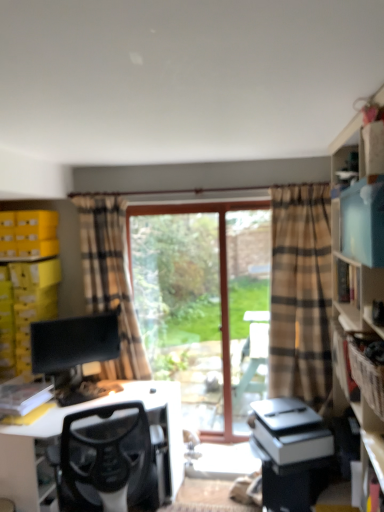
Measure the distance between white plastic printer at center and camera.

white plastic printer at center and camera are 2.36 meters apart.

Measure the distance between point (x=145, y=447) and camera.

A distance of 2.30 meters exists between point (x=145, y=447) and camera.

Locate an element on the screen. This screenshot has height=512, width=384. wooden screen door at center is located at coordinates (248, 306).

Find the location of a particular element. matte blue shelf at right, which appears as the 1th shelf when viewed from the right is located at coordinates (337, 291).

Is black mesh chair at lower left next to brown cardboard crate at right and touching it?

No, black mesh chair at lower left is not in contact with brown cardboard crate at right.

In the image, there is a brown cardboard crate at right. In order to click on chair below it (from a real-world perspective) in this screenshot , I will do `click(107, 459)`.

Who is smaller, black mesh chair at lower left or brown cardboard crate at right?

Smaller between the two is brown cardboard crate at right.

From the image's perspective, is black mesh chair at lower left on brown cardboard crate at right?

No, from the image's perspective, black mesh chair at lower left is not on top of brown cardboard crate at right.

From a real-world perspective, is wooden screen door at center located beneath clear glass window at center?

Yes.

From the image's perspective, is wooden screen door at center located above or below clear glass window at center?

wooden screen door at center is above clear glass window at center.

Does wooden screen door at center turn towards clear glass window at center?

No, wooden screen door at center is not facing towards clear glass window at center.

This screenshot has height=512, width=384. I want to click on window behind the wooden screen door at center, so click(204, 303).

Are yellow cardboard boxes at left, which ranks as the 1th shelf in left-to-right order, and black mesh chair at lower left making contact?

No, yellow cardboard boxes at left, which ranks as the 1th shelf in left-to-right order, is not beside black mesh chair at lower left.

Is black mesh chair at lower left located within yellow cardboard boxes at left, the 1th shelf viewed from the back?

Actually, black mesh chair at lower left is outside yellow cardboard boxes at left, the 1th shelf viewed from the back.

From the image's perspective, between yellow cardboard boxes at left, the 1th shelf viewed from the back, and black mesh chair at lower left, who is located below?

black mesh chair at lower left is shown below in the image.

This screenshot has height=512, width=384. Find the location of `curtain lying on the left of white plastic printer at center`. curtain lying on the left of white plastic printer at center is located at coordinates coord(110,279).

Does point (112, 223) come farther from viewer compared to point (308, 412)?

That is True.

In the scene shown: Is beige plaid curtain at left positioned with its back to white plastic printer at center?

No, beige plaid curtain at left is not facing the opposite direction of white plastic printer at center.

Could white plastic printer at center be considered to be inside beige plaid curtain at left?

No, white plastic printer at center is located outside of beige plaid curtain at left.

Is black mesh chair at lower left in front of or behind white plastic printer at center in the image?

Clearly, black mesh chair at lower left is behind white plastic printer at center.

Is black mesh chair at lower left wider or thinner than white plastic printer at center?

In the image, black mesh chair at lower left appears to be wider than white plastic printer at center.

Which of these two, black mesh chair at lower left or white plastic printer at center, is bigger?

black mesh chair at lower left is bigger.

Is matte black monitor at left positioned with its back to beige plaid curtain at left?

No, matte black monitor at left is not facing the opposite direction of beige plaid curtain at left.

Which object is more forward, matte black monitor at left or beige plaid curtain at left?

matte black monitor at left.

Consider the image. From the image's perspective, is matte black monitor at left under beige plaid curtain at left?

Yes, from the image's perspective, matte black monitor at left is below beige plaid curtain at left.

Who is smaller, matte black monitor at left or beige plaid curtain at left?

Smaller between the two is matte black monitor at left.

Is black mesh chair at lower left far from clear glass window at center?

No, black mesh chair at lower left is in close proximity to clear glass window at center.

Does black mesh chair at lower left have a lesser height compared to clear glass window at center?

Indeed, black mesh chair at lower left has a lesser height compared to clear glass window at center.

Is black mesh chair at lower left not inside clear glass window at center?

black mesh chair at lower left lies outside clear glass window at center's area.

Looking at this image, from the image's perspective, which one is positioned higher, black mesh chair at lower left or clear glass window at center?

clear glass window at center, from the image's perspective.

Find the location of a particular element. crate that is above the black mesh chair at lower left (from a real-world perspective) is located at coordinates (367, 378).

The width and height of the screenshot is (384, 512). Find the location of `screen door in front of the clear glass window at center`. screen door in front of the clear glass window at center is located at coordinates (248, 306).

Based on their spatial positions, is brown cardboard crate at right or beige plaid curtain at left further from wooden screen door at center?

The object further to wooden screen door at center is brown cardboard crate at right.

When comparing their distances from clear glass window at center, does beige plaid curtain at left or wooden screen door at center seem further?

beige plaid curtain at left is further to clear glass window at center.

When comparing their distances from beige plaid curtain at left, does white plastic printer at center or wooden screen door at center seem closer?

Based on the image, wooden screen door at center appears to be nearer to beige plaid curtain at left.

Estimate the real-world distances between objects in this image. Which object is further from clear glass window at center, beige plaid curtain at left or black mesh chair at lower left?

Based on the image, black mesh chair at lower left appears to be further to clear glass window at center.

In the scene shown: Based on their spatial positions, is yellow cardboard boxes at left, which ranks as the 1th shelf in left-to-right order, or white plastic printer at center closer to wooden screen door at center?

white plastic printer at center is positioned closer to the anchor wooden screen door at center.

Considering their positions, is yellow cardboard boxes at left, the second shelf viewed from the front, positioned closer to white plastic printer at center than clear glass window at center?

clear glass window at center is closer to white plastic printer at center.

Based on their spatial positions, is black mesh chair at lower left or yellow cardboard boxes at left, the second shelf viewed from the front, further from matte blue shelf at right, which is counted as the 2th shelf, starting from the left?

yellow cardboard boxes at left, the second shelf viewed from the front, lies further to matte blue shelf at right, which is counted as the 2th shelf, starting from the left, than the other object.

Looking at this image, from the image, which object appears to be farther from matte black monitor at left, beige plaid curtain at left or matte blue shelf at right, the 1th shelf in the front-to-back sequence?

matte blue shelf at right, the 1th shelf in the front-to-back sequence, lies further to matte black monitor at left than the other object.

Locate an element on the screen. Image resolution: width=384 pixels, height=512 pixels. entertainment center between yellow cardboard boxes at left, the 1th shelf viewed from the back, and wooden screen door at center is located at coordinates (61, 431).

You are a GUI agent. You are given a task and a screenshot of the screen. Output one action in this format:
    pyautogui.click(x=<x>, y=<y>)
    Task: Click on the entertainment center located between brown cardboard crate at right and wooden screen door at center in the depth direction
    Image resolution: width=384 pixels, height=512 pixels.
    Given the screenshot: What is the action you would take?
    pyautogui.click(x=61, y=431)

Locate an element on the screen. Image resolution: width=384 pixels, height=512 pixels. computer monitor between black mesh chair at lower left and clear glass window at center in the front-back direction is located at coordinates (75, 351).

Find the location of a particular element. curtain located between brown cardboard crate at right and clear glass window at center in the depth direction is located at coordinates (110, 279).